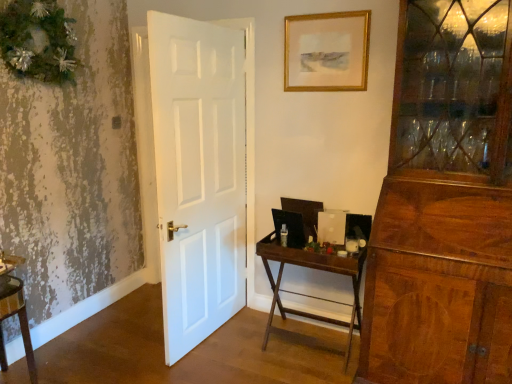
Find the location of a particular element. This screenshot has width=512, height=384. vacant space underneath green textured wreath at upper left (from a real-world perspective) is located at coordinates point(68,336).